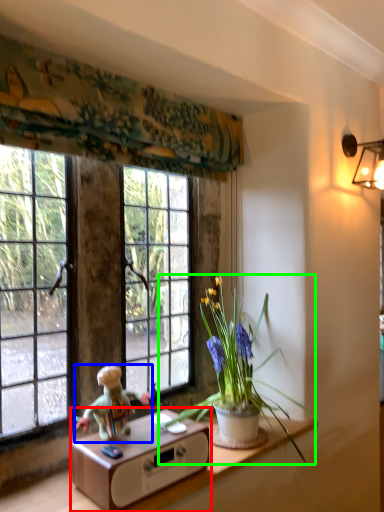
Question: Based on their relative distances, which object is farther from table (highlighted by a red box)? Choose from person (highlighted by a blue box) and houseplant (highlighted by a green box).

Choices:
 (A) person
 (B) houseplant

Answer: (B)